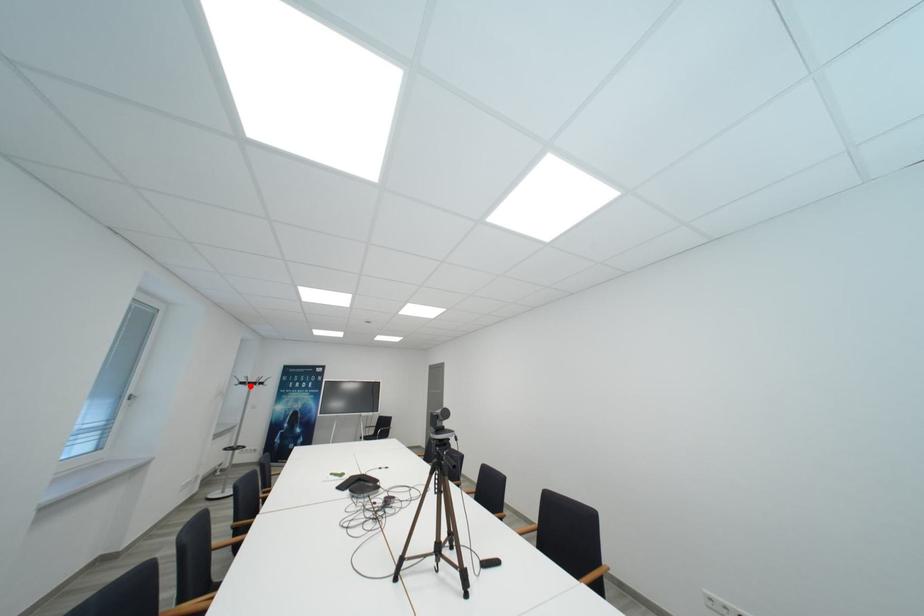
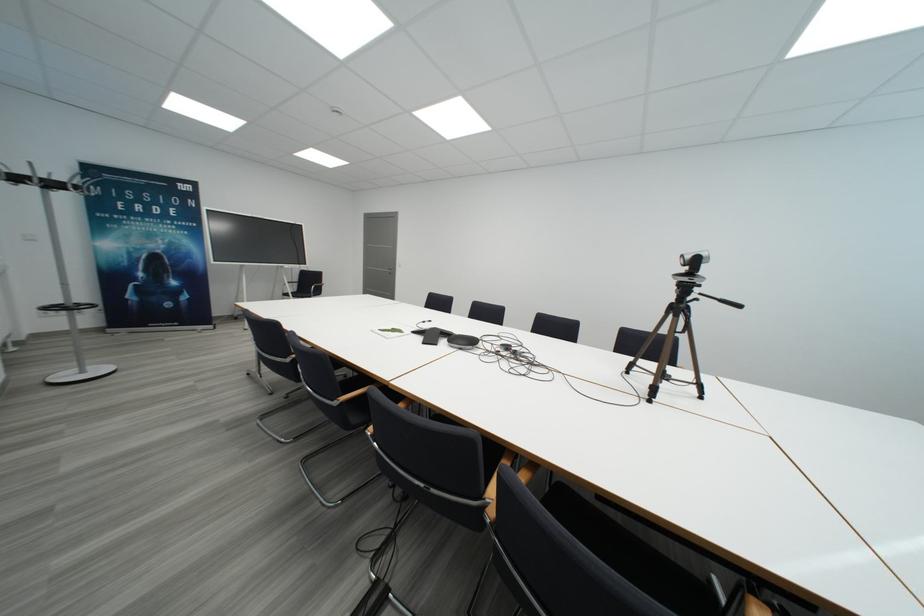
Question: I am providing you with two images of the same scene from different viewpoints. Image1 has a red point marked. In image2, the corresponding 3D location appears at what relative position? Reply with the corresponding letter.

Choices:
 (A) Closer
 (B) Farther

Answer: (A)